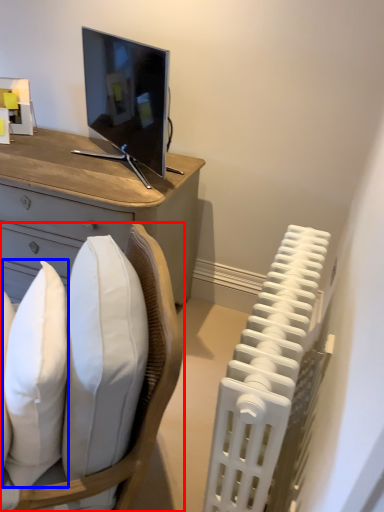
Question: Among these objects, which one is farthest to the camera, chair (highlighted by a red box) or pillow (highlighted by a blue box)?

Choices:
 (A) chair
 (B) pillow

Answer: (B)